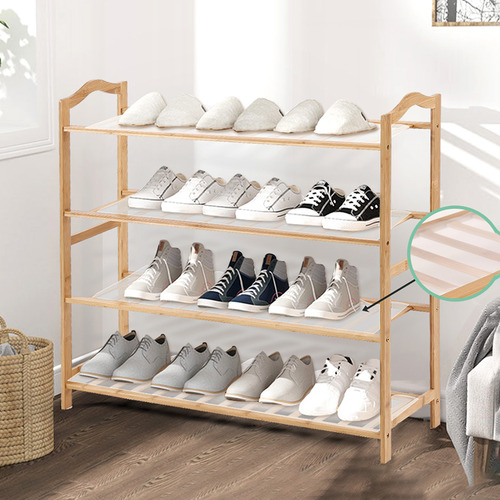
Image resolution: width=500 pixels, height=500 pixels. In order to click on shoes on shelf above top shelf in this screenshot , I will do `click(144, 194)`, `click(187, 196)`, `click(233, 194)`, `click(265, 196)`, `click(317, 202)`.